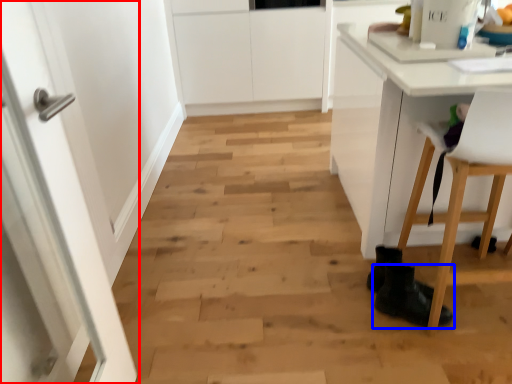
Question: Which point is further to the camera, door (highlighted by a red box) or footwear (highlighted by a blue box)?

Choices:
 (A) door
 (B) footwear

Answer: (B)